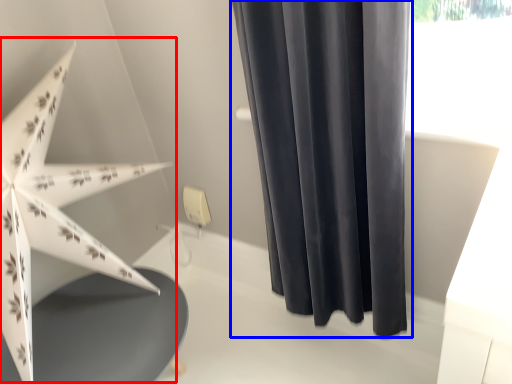
Question: Which of the following is the farthest to the observer, umbrella (highlighted by a red box) or curtain (highlighted by a blue box)?

Choices:
 (A) umbrella
 (B) curtain

Answer: (B)